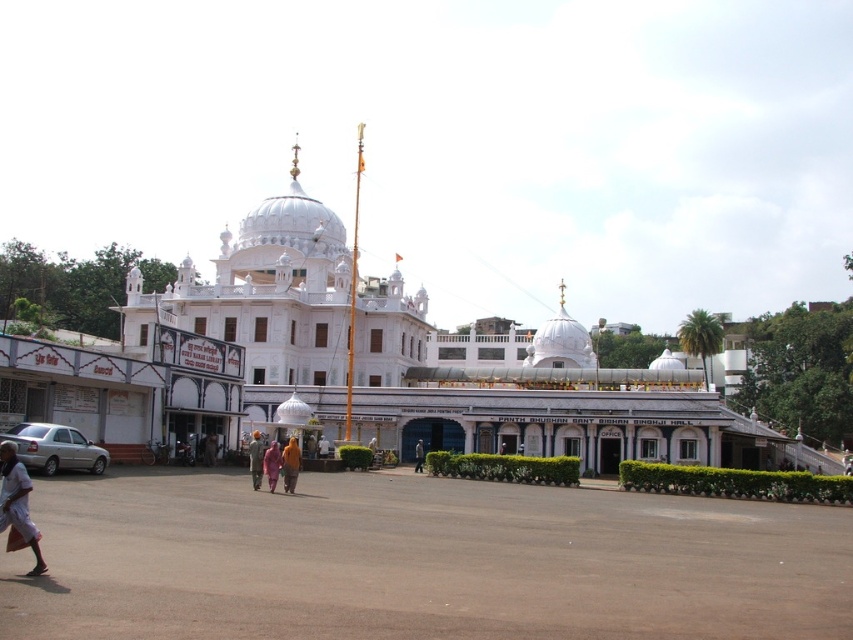
You are standing in front of the grand white building and want to walk from the brown asphalt plaza at lower center to the pink fabric at center. Which direction should you move relative to the plaza?

You should move to the right from the brown asphalt plaza at lower center to reach the pink fabric at center since the plaza is to the left of the fabric.

You are standing in front of the grand white Gurdwara with multiple domes. You see the brown asphalt plaza at lower center and the pink fabric at center. Which object is closer to you?

The brown asphalt plaza at lower center is closer to the viewer than the pink fabric at center.